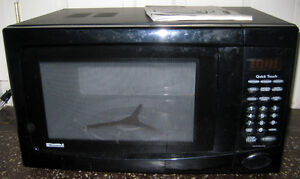
Where is `plate`? The height and width of the screenshot is (179, 300). plate is located at coordinates (115, 108).